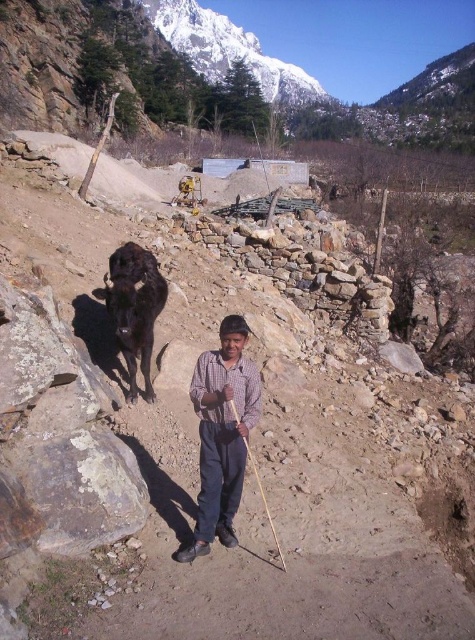
You are standing at the point with coordinates point (155, 266) and want to walk towards the point with coordinates point (222, 465). Which direction should you face to move towards it?

You should face towards the direction of the camera because point (222, 465) is closer to the camera than point (155, 266).

Based on the scene, if you were to draw a straight line from the checkered fabric shirt at center to the black glossy yak at center, which object would be closer to the bottom of the image?

The checkered fabric shirt at center is closer to the bottom of the image because it is positioned below the black glossy yak at center.

You are a hiker who needs to cross a narrow path between the checkered fabric shirt at center and the black glossy yak at center. The path is 3 meters wide. Can you safely pass through?

The checkered fabric shirt at center is 3.49 meters away from the black glossy yak at center. Since the path is 3 meters wide, the distance between them is slightly wider than the path, so you can safely pass through.